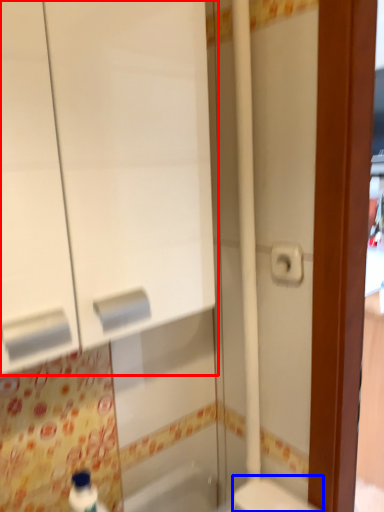
Question: Which point is closer to the camera, medicine cabinet (highlighted by a red box) or toilet (highlighted by a blue box)?

Choices:
 (A) medicine cabinet
 (B) toilet

Answer: (A)